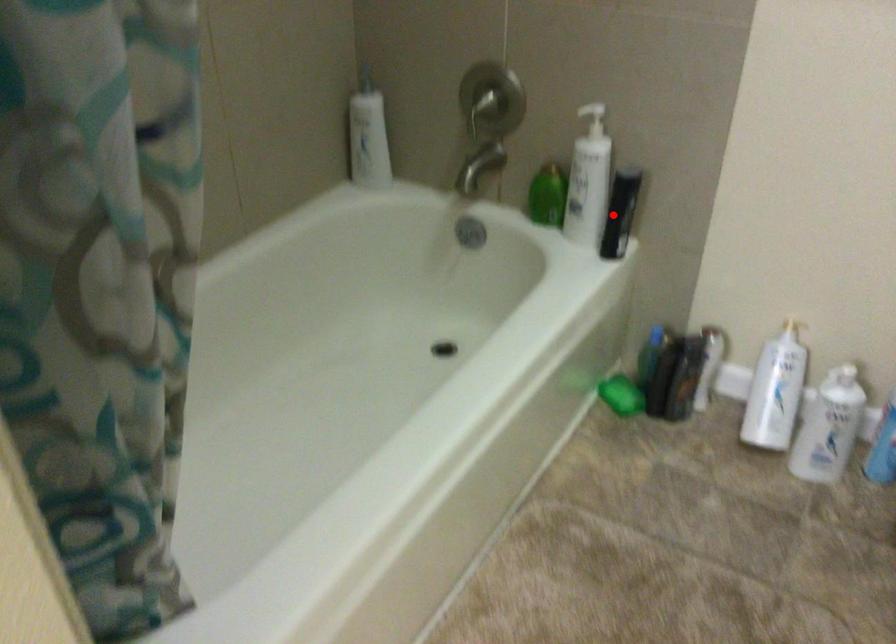
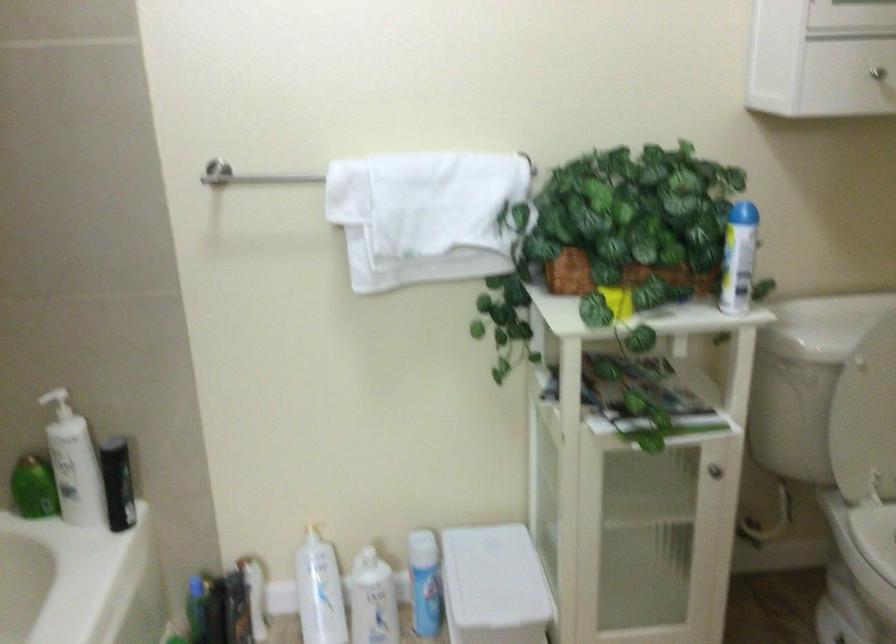
Find the pixel in the second image that matches the highlighted location in the first image.

(117, 483)